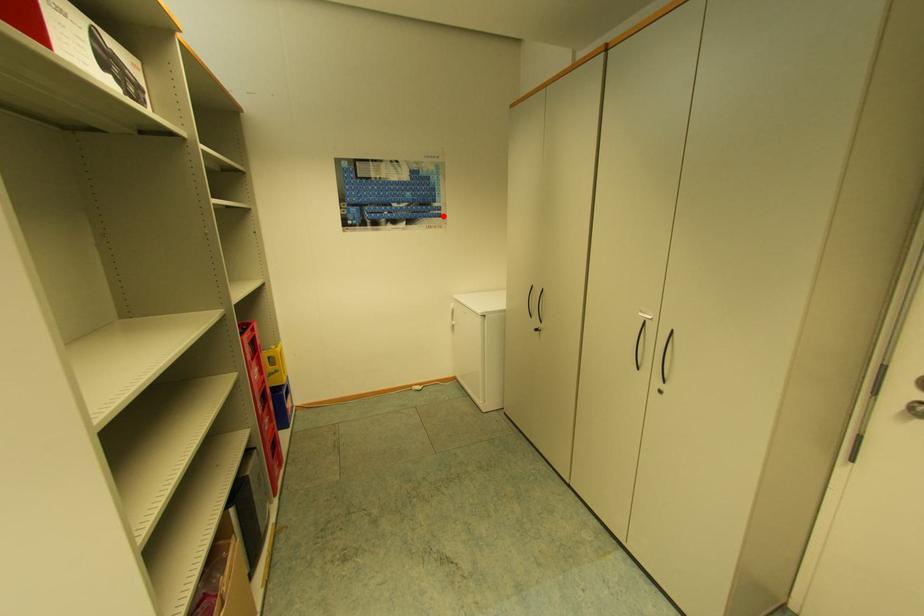
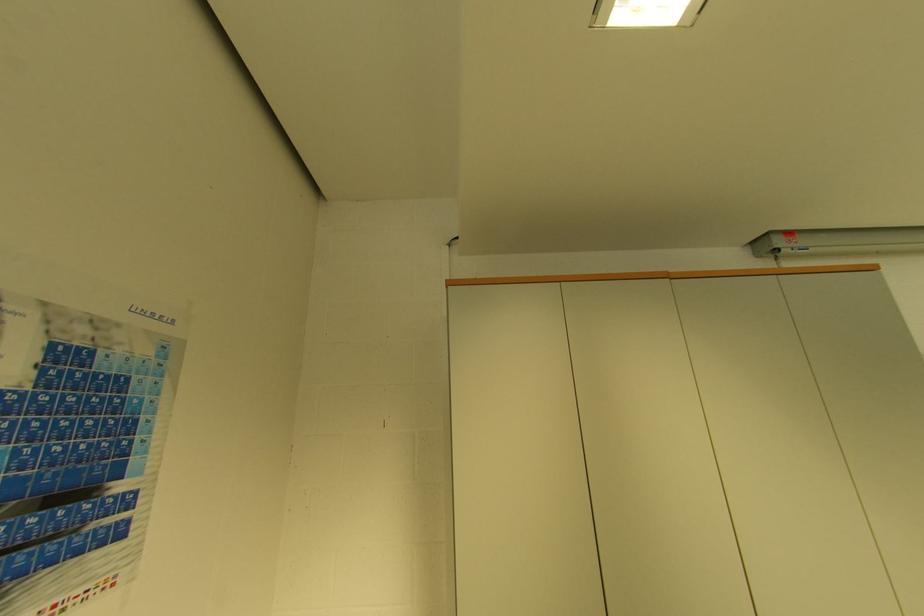
Locate, in the second image, the point that corresponds to the highlighted location in the first image.

(123, 533)